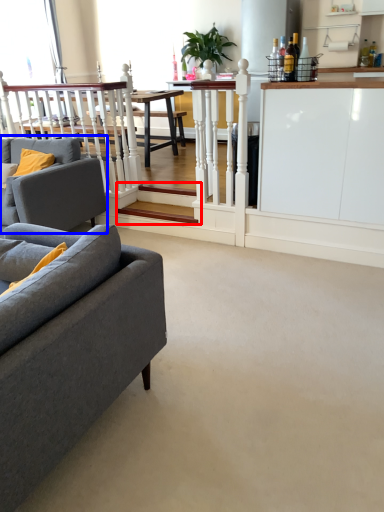
Question: Which of the following is the closest to the observer, stairwell (highlighted by a red box) or studio couch (highlighted by a blue box)?

Choices:
 (A) stairwell
 (B) studio couch

Answer: (B)